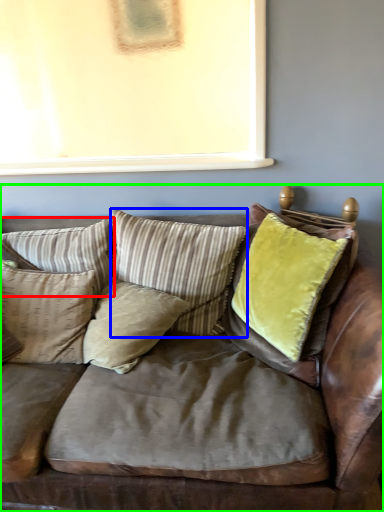
Question: Which object is positioned closest to pillow (highlighted by a red box)? Select from pillow (highlighted by a blue box) and studio couch (highlighted by a green box).

Choices:
 (A) pillow
 (B) studio couch

Answer: (A)